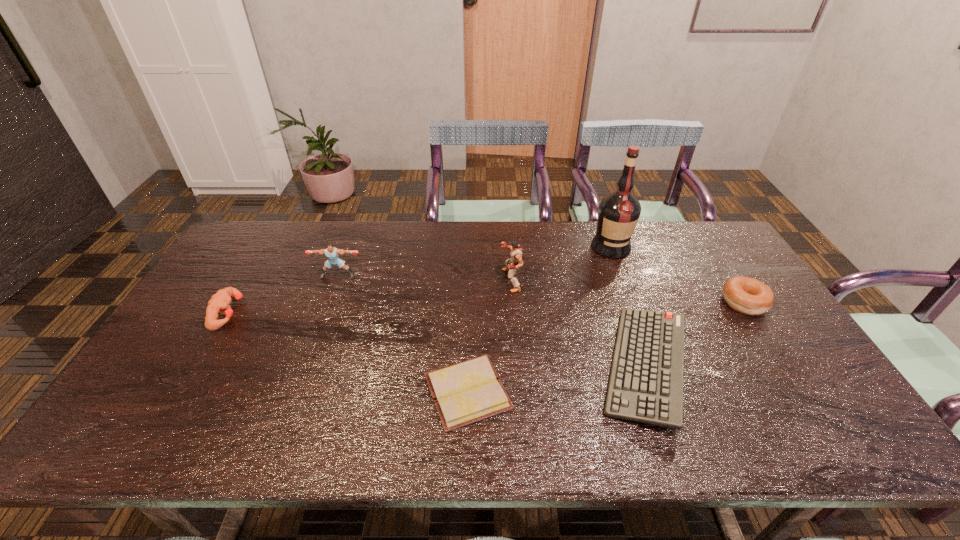
At what (x,y) coordinates should I click in order to perform the action: click on vacant space that satisfies the following two spatial constraints: 1. on the surface of the liquor; 2. with the gloves of the leftmost puncher facing forward. Please return your answer as a coordinate pair (x, y). Image resolution: width=960 pixels, height=540 pixels. Looking at the image, I should click on tap(636, 313).

Where is `free region that satisfies the following two spatial constraints: 1. with the gloves of the computer keyboard facing forward; 2. on the right side of the leftmost object`? This screenshot has height=540, width=960. free region that satisfies the following two spatial constraints: 1. with the gloves of the computer keyboard facing forward; 2. on the right side of the leftmost object is located at coordinates (197, 367).

Where is `vacant region that satisfies the following two spatial constraints: 1. on the front-facing side of the computer keyboard; 2. on the left side of the sixth object from right to left`? The height and width of the screenshot is (540, 960). vacant region that satisfies the following two spatial constraints: 1. on the front-facing side of the computer keyboard; 2. on the left side of the sixth object from right to left is located at coordinates (304, 367).